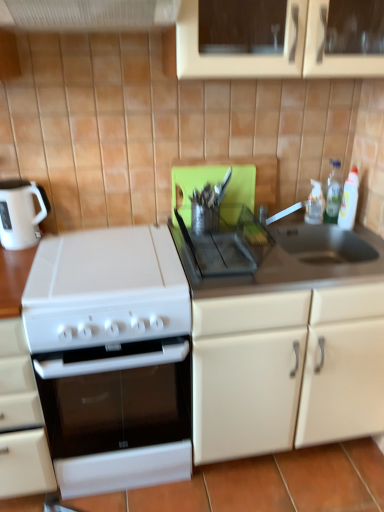
Question: Considering the relative sizes of black plastic tray at center, the second gas stove in the left-to-right sequence, and white matte oven at lower left, the 1th cabinetry viewed from the left, in the image provided, is black plastic tray at center, the second gas stove in the left-to-right sequence, taller than white matte oven at lower left, the 1th cabinetry viewed from the left,?

Choices:
 (A) yes
 (B) no

Answer: (B)

Question: Does black plastic tray at center, the second gas stove positioned from the bottom, have a greater width compared to white matte oven at lower left, the 1th cabinetry viewed from the left?

Choices:
 (A) no
 (B) yes

Answer: (A)

Question: Considering the relative positions of black plastic tray at center, the second gas stove in the left-to-right sequence, and white matte oven at lower left, the 2th cabinetry when ordered from right to left, in the image provided, is black plastic tray at center, the second gas stove in the left-to-right sequence, behind white matte oven at lower left, the 2th cabinetry when ordered from right to left,?

Choices:
 (A) yes
 (B) no

Answer: (A)

Question: Is the depth of black plastic tray at center, the second gas stove in the left-to-right sequence, less than that of white matte oven at lower left, the 2th cabinetry when ordered from right to left?

Choices:
 (A) yes
 (B) no

Answer: (B)

Question: Is black plastic tray at center, the second gas stove positioned from the bottom, placed right next to white matte oven at lower left, the 1th cabinetry viewed from the left?

Choices:
 (A) no
 (B) yes

Answer: (A)

Question: Is black plastic tray at center, the second gas stove in the left-to-right sequence, smaller than white matte oven at lower left, the 2th cabinetry when ordered from right to left?

Choices:
 (A) yes
 (B) no

Answer: (A)

Question: Can you confirm if black plastic tray at center, which is the first gas stove in right-to-left order, is taller than white plastic exhaust hood at upper center?

Choices:
 (A) yes
 (B) no

Answer: (B)

Question: Is black plastic tray at center, which is the first gas stove in right-to-left order, bigger than white plastic exhaust hood at upper center?

Choices:
 (A) no
 (B) yes

Answer: (A)

Question: Is the depth of black plastic tray at center, the second gas stove in the left-to-right sequence, less than that of white plastic exhaust hood at upper center?

Choices:
 (A) no
 (B) yes

Answer: (A)

Question: Does black plastic tray at center, positioned as the first gas stove in top-to-bottom order, have a smaller size compared to white plastic exhaust hood at upper center?

Choices:
 (A) no
 (B) yes

Answer: (B)

Question: Considering the relative sizes of black plastic tray at center, positioned as the first gas stove in top-to-bottom order, and white plastic exhaust hood at upper center in the image provided, is black plastic tray at center, positioned as the first gas stove in top-to-bottom order, wider than white plastic exhaust hood at upper center?

Choices:
 (A) no
 (B) yes

Answer: (A)

Question: From a real-world perspective, is black plastic tray at center, which is the first gas stove in right-to-left order, located higher than white plastic exhaust hood at upper center?

Choices:
 (A) yes
 (B) no

Answer: (B)

Question: Considering the relative positions of white glossy gas stove at left, which ranks as the first gas stove in bottom-to-top order, and clear plastic bottle at upper right, which ranks as the 2th bottle in right-to-left order, in the image provided, is white glossy gas stove at left, which ranks as the first gas stove in bottom-to-top order, to the left of clear plastic bottle at upper right, which ranks as the 2th bottle in right-to-left order, from the viewer's perspective?

Choices:
 (A) yes
 (B) no

Answer: (A)